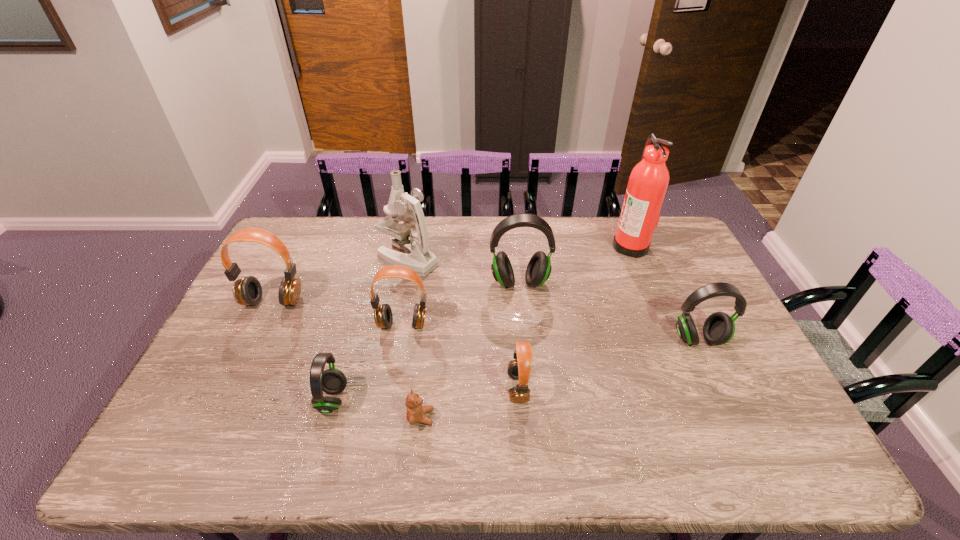
This screenshot has height=540, width=960. In the image, there is a desktop. In order to click on vacant space at the near right corner in this screenshot , I will do `click(816, 468)`.

At what (x,y) coordinates should I click in order to perform the action: click on vacant region between the second black headset from right to left and the fire extinguisher. Please return your answer as a coordinate pair (x, y). The image size is (960, 540). Looking at the image, I should click on (575, 264).

Where is `free spot between the rightmost brown headset and the biggest brown headset`? Image resolution: width=960 pixels, height=540 pixels. free spot between the rightmost brown headset and the biggest brown headset is located at coordinates [396, 345].

Locate an element on the screen. The height and width of the screenshot is (540, 960). vacant point located between the biggest black headset and the smallest black headset is located at coordinates (426, 341).

Image resolution: width=960 pixels, height=540 pixels. I want to click on vacant region between the smallest brown headset and the farthest black headset, so click(518, 335).

Locate an element on the screen. The width and height of the screenshot is (960, 540). vacant space that is in between the rightmost brown headset and the teddy bear is located at coordinates (469, 402).

The width and height of the screenshot is (960, 540). What are the coordinates of `free spot between the nearest black headset and the rightmost brown headset` in the screenshot? It's located at (425, 394).

Find the location of a particular element. vacant space that's between the leftmost headset and the tallest object is located at coordinates (452, 273).

I want to click on vacant region between the second headset from left to right and the second farthest brown headset, so click(368, 362).

At what (x,y) coordinates should I click in order to perform the action: click on vacant region between the leftmost black headset and the eighth shortest object. Please return your answer as a coordinate pair (x, y). Looking at the image, I should click on (371, 329).